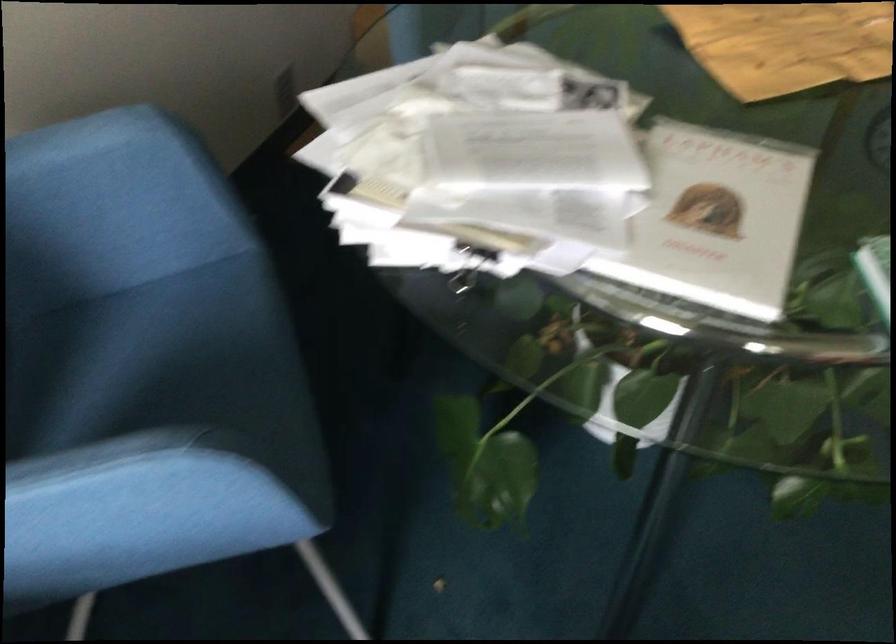
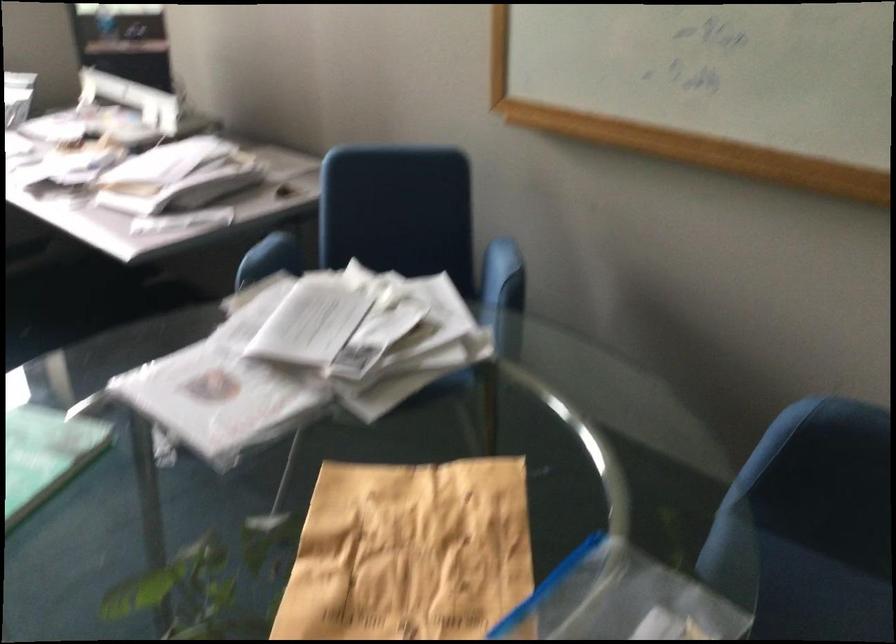
The point at (108, 129) is marked in the first image. Where is the corresponding point in the second image?

(498, 265)